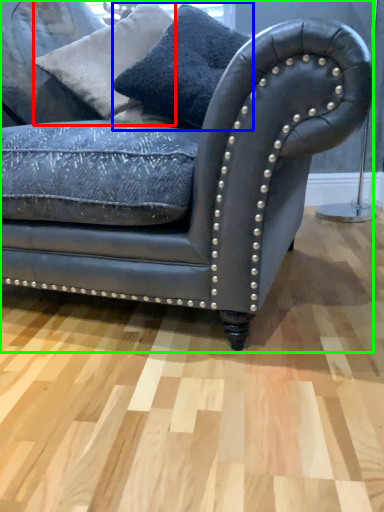
Question: Which object is the closest to the pillow (highlighted by a red box)? Choose among these: pillow (highlighted by a blue box) or studio couch (highlighted by a green box).

Choices:
 (A) pillow
 (B) studio couch

Answer: (A)